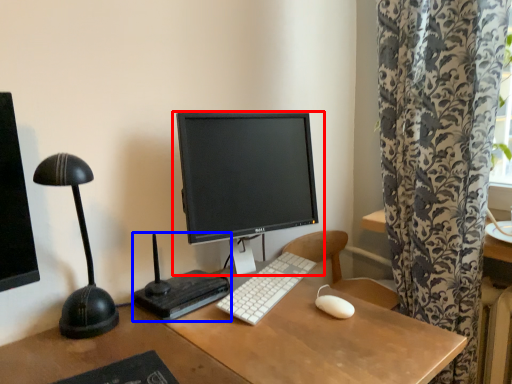
Question: Which object appears farthest to the camera in this image, computer monitor (highlighted by a red box) or equipment (highlighted by a blue box)?

Choices:
 (A) computer monitor
 (B) equipment

Answer: (A)